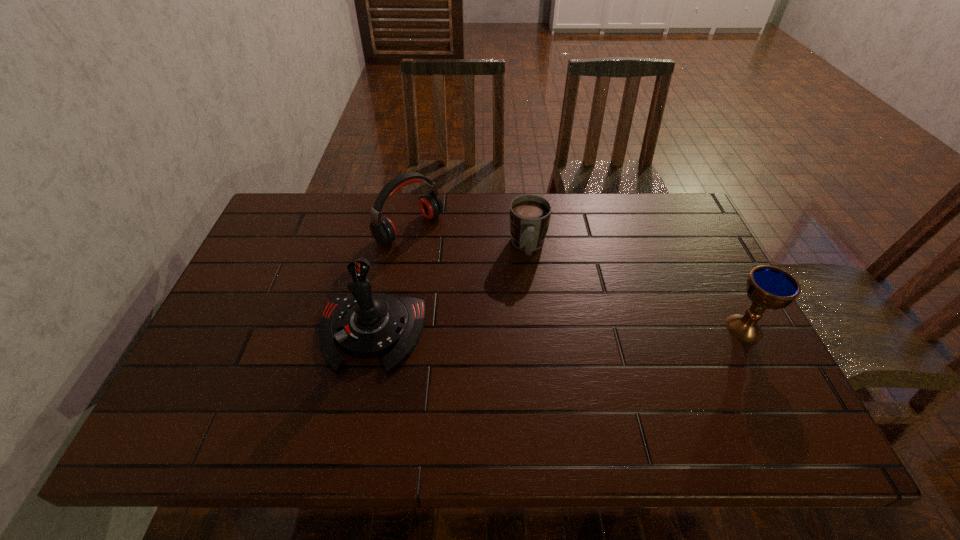
Where is `vacant region at the far left corner of the desktop`? vacant region at the far left corner of the desktop is located at coordinates (310, 212).

Identify the location of free space at the near right corner of the desktop. (752, 397).

Where is `vacant point located between the earphone and the joystick`? The width and height of the screenshot is (960, 540). vacant point located between the earphone and the joystick is located at coordinates (390, 281).

Image resolution: width=960 pixels, height=540 pixels. I want to click on empty space that is in between the mug and the joystick, so click(x=449, y=290).

At what (x,y) coordinates should I click in order to perform the action: click on vacant area between the third object from left to right and the joystick. Please return your answer as a coordinate pair (x, y). Image resolution: width=960 pixels, height=540 pixels. Looking at the image, I should click on (449, 290).

The width and height of the screenshot is (960, 540). I want to click on free spot between the chalice and the mug, so click(636, 287).

Find the location of a particular element. The width and height of the screenshot is (960, 540). free spot between the joystick and the rightmost object is located at coordinates (558, 331).

Where is `free area in between the second object from right to left and the earphone`? The height and width of the screenshot is (540, 960). free area in between the second object from right to left and the earphone is located at coordinates (468, 238).

Where is `free point between the third object from left to right and the rightmost object`? free point between the third object from left to right and the rightmost object is located at coordinates (636, 287).

At what (x,y) coordinates should I click in order to perform the action: click on vacant area between the shortest object and the earphone. Please return your answer as a coordinate pair (x, y). Image resolution: width=960 pixels, height=540 pixels. Looking at the image, I should click on (468, 238).